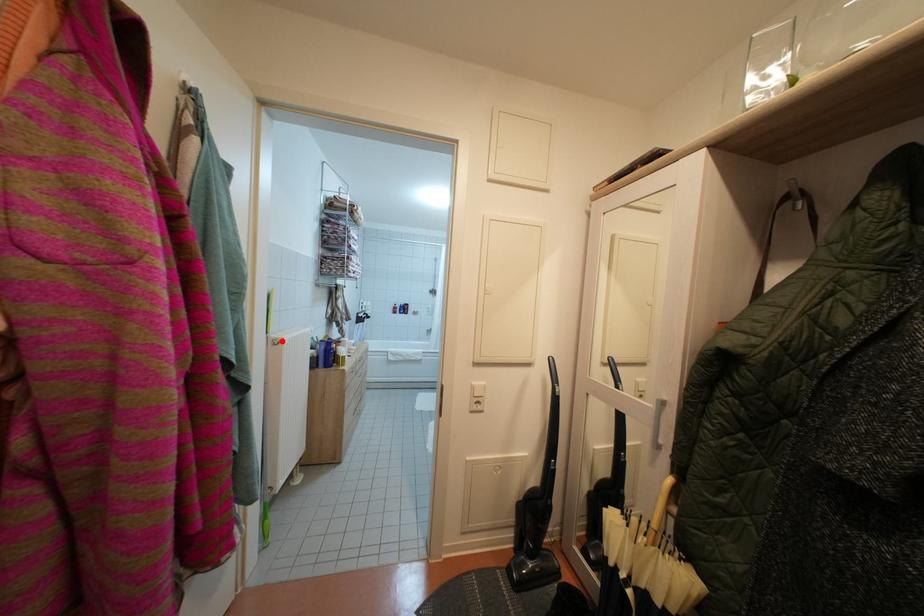
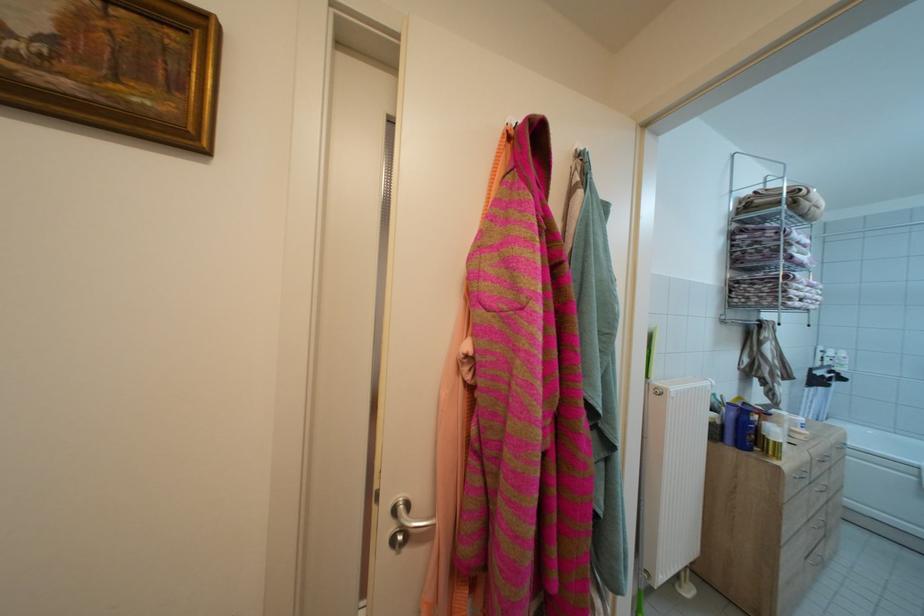
Where in the second image is the point corresponding to the highlighted location from the first image?

(663, 389)